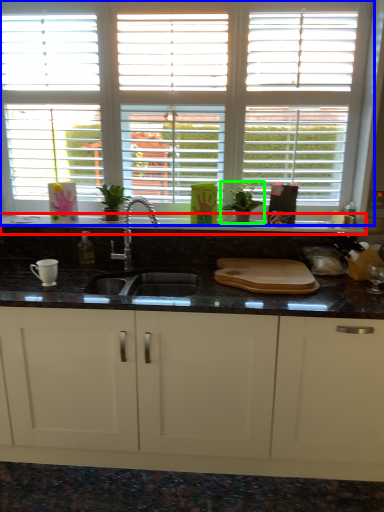
Question: Estimate the real-world distances between objects in this image. Which object is closer to counter top (highlighted by a red box), window (highlighted by a blue box) or plant (highlighted by a green box)?

Choices:
 (A) window
 (B) plant

Answer: (B)